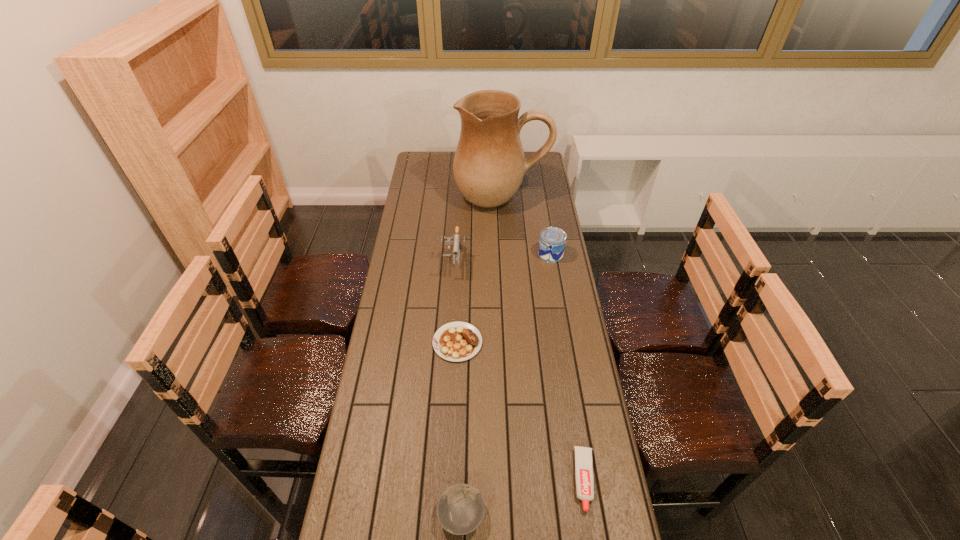
Locate an element on the screen. vacant space positioned 0.370m on the front label of the can is located at coordinates (452, 254).

At what (x,y) coordinates should I click in order to perform the action: click on vacant space located on the left of the toothpaste. Please return your answer as a coordinate pair (x, y). The height and width of the screenshot is (540, 960). Looking at the image, I should click on (495, 480).

Image resolution: width=960 pixels, height=540 pixels. I want to click on vacant space located 0.200m on the right of the steak, so click(x=538, y=342).

Image resolution: width=960 pixels, height=540 pixels. Find the location of `cream pitcher that is at the right edge`. cream pitcher that is at the right edge is located at coordinates (489, 164).

Locate an element on the screen. The height and width of the screenshot is (540, 960). can positioned at the right edge is located at coordinates (552, 242).

The height and width of the screenshot is (540, 960). I want to click on toothpaste positioned at the right edge, so click(583, 455).

This screenshot has width=960, height=540. What are the coordinates of `vacant space at the left edge of the desktop` in the screenshot? It's located at (395, 287).

You are a GUI agent. You are given a task and a screenshot of the screen. Output one action in this format:
    pyautogui.click(x=<x>, y=<y>)
    Task: Click on the free location at the right edge of the desktop
    
    Given the screenshot: What is the action you would take?
    pyautogui.click(x=543, y=367)

The image size is (960, 540). Identify the location of vacant space at the far left corner. (437, 156).

The height and width of the screenshot is (540, 960). In order to click on vacant area that lies between the gun and the can in this screenshot , I will do `click(502, 258)`.